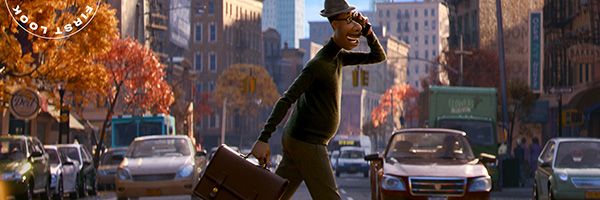
The width and height of the screenshot is (600, 200). Identify the location of phone. (364, 26).